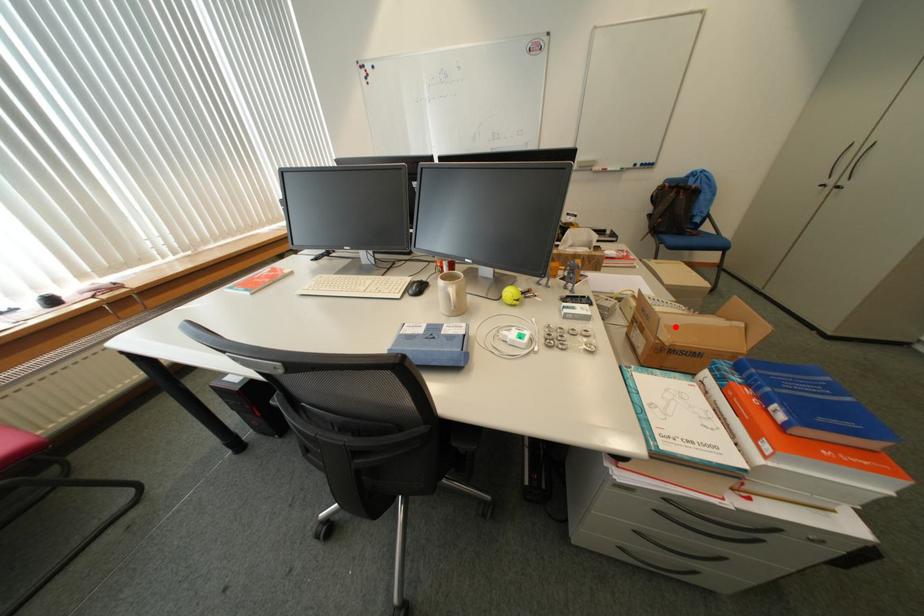
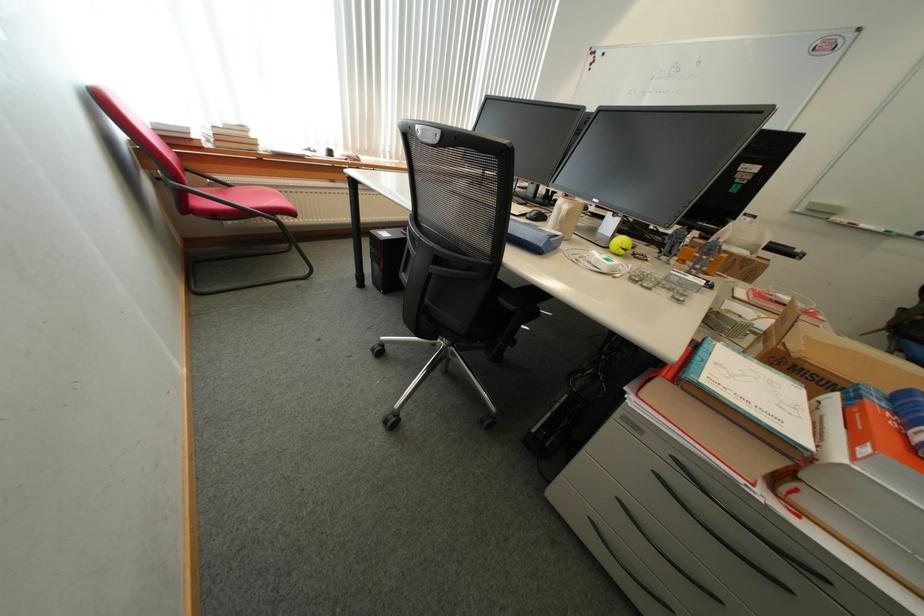
Question: A red point is marked in image1. In image2, is the corresponding 3D point closer to the camera or farther? Reply with the corresponding letter.

Choices:
 (A) The corresponding 3D point is closer.
 (B) The corresponding 3D point is farther.

Answer: (A)